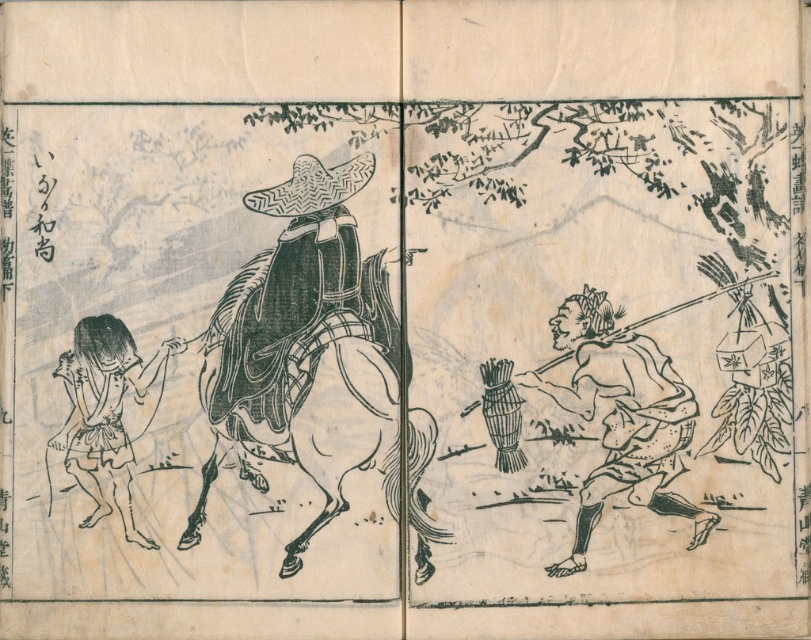
Question: Which is farther from the woven straw hat at center?

Choices:
 (A) black paper doll at lower left
 (B) white paper horse at center

Answer: (A)

Question: Can you confirm if white paper horse at center is positioned below wooden staff at lower right?

Choices:
 (A) yes
 (B) no

Answer: (B)

Question: Which object appears closest to the camera in this image?

Choices:
 (A) white paper horse at center
 (B) black paper doll at lower left

Answer: (B)

Question: Which of the following is the closest to the observer?

Choices:
 (A) (331, 204)
 (B) (215, 314)
 (C) (76, 340)

Answer: (C)

Question: Can you confirm if wooden staff at lower right is bigger than woven straw hat at center?

Choices:
 (A) no
 (B) yes

Answer: (B)

Question: Considering the relative positions of white paper horse at center and woven straw hat at center in the image provided, where is white paper horse at center located with respect to woven straw hat at center?

Choices:
 (A) right
 (B) left

Answer: (B)